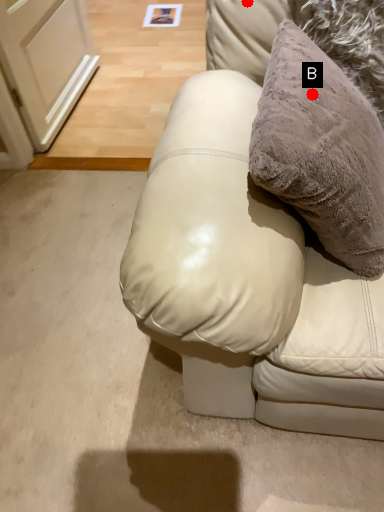
Question: Two points are circled on the image, labeled by A and B beside each circle. Which point appears closest to the camera in this image?

Choices:
 (A) A is closer
 (B) B is closer

Answer: (B)